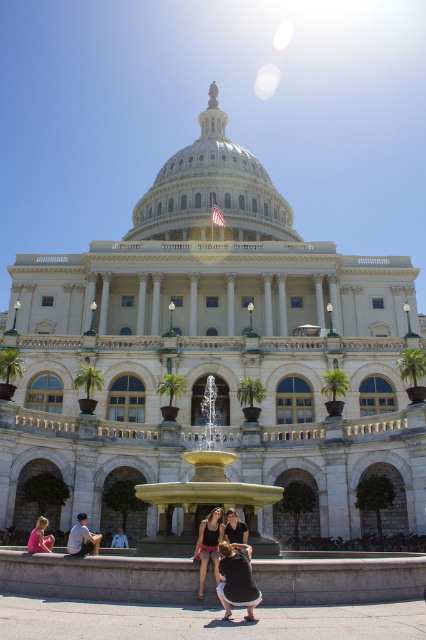
Is light brown leather jacket at lower left taller than matte black dress at lower left?

No.

Can you confirm if light brown leather jacket at lower left is positioned to the left of matte black dress at lower left?

Incorrect, light brown leather jacket at lower left is not on the left side of matte black dress at lower left.

The image size is (426, 640). What do you see at coordinates (81, 538) in the screenshot? I see `light brown leather jacket at lower left` at bounding box center [81, 538].

Identify the location of light brown leather jacket at lower left. The width and height of the screenshot is (426, 640). (81, 538).

Is point (262, 356) positioned before point (236, 540)?

No, it is behind (236, 540).

Who is taller, white marble palace at center or black fabric dress at center?

white marble palace at center

Is point (210, 118) positioned in front of point (245, 528)?

No, (210, 118) is behind (245, 528).

I want to click on white marble palace at center, so click(x=213, y=349).

Looking at this image, does matte black tank top at center have a greater width compared to matte black dress at lower left?

Incorrect, matte black tank top at center's width does not surpass matte black dress at lower left's.

Locate an element on the screen. matte black tank top at center is located at coordinates (209, 545).